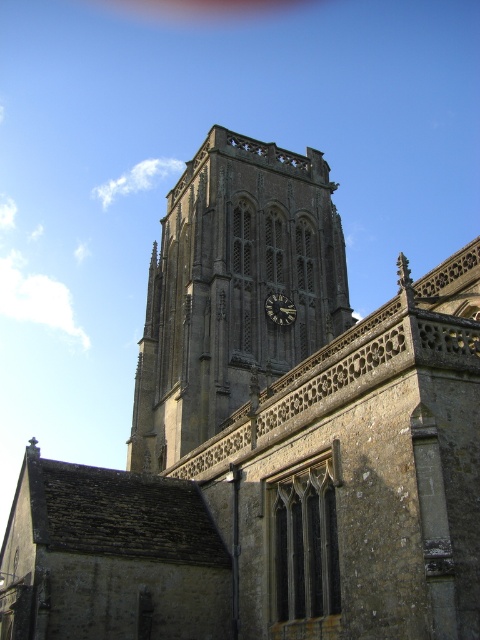
You are standing in front of the historic stone church and want to determine the relative positions of two points marked on the tower. Which point is closer to you, point [177,228] or point [276,310]?

Point [177,228] is closer to you because it is further to the viewer than point [276,310].

You are standing in front of the historic stone church and want to take a photo of both the brown stone clock tower at center and the dark gray stone clock at center. Which object should you focus on first to ensure both are in frame?

You should focus on the dark gray stone clock at center first because the brown stone clock tower at center is positioned over it, meaning the tower will naturally be in the background and the clock in the foreground. By focusing on the closer object, the clock, both will be in focus.